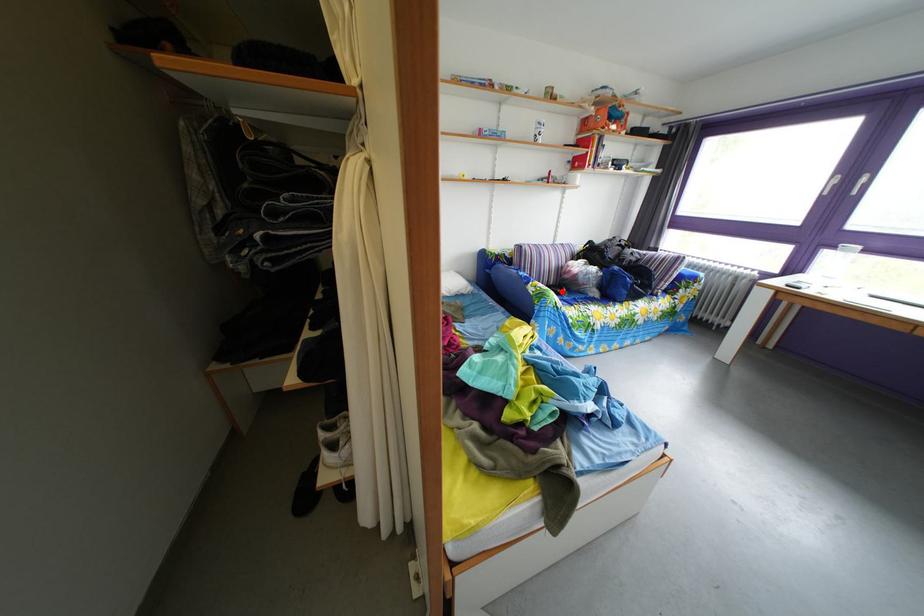
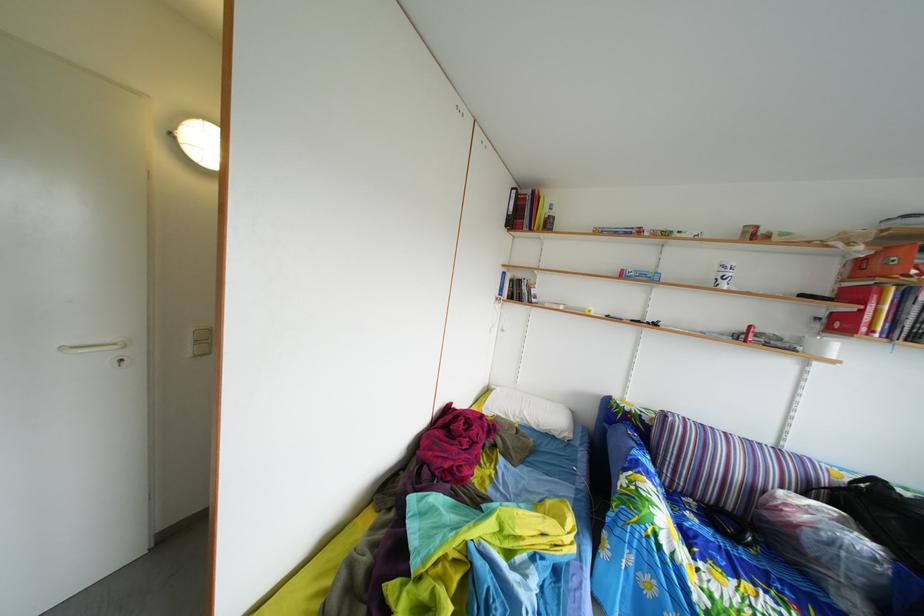
Question: A red point is marked in image1. In image2, is the corresponding 3D point closer to the camera or farther? Reply with the corresponding letter.

Choices:
 (A) The corresponding 3D point is closer.
 (B) The corresponding 3D point is farther.

Answer: (A)